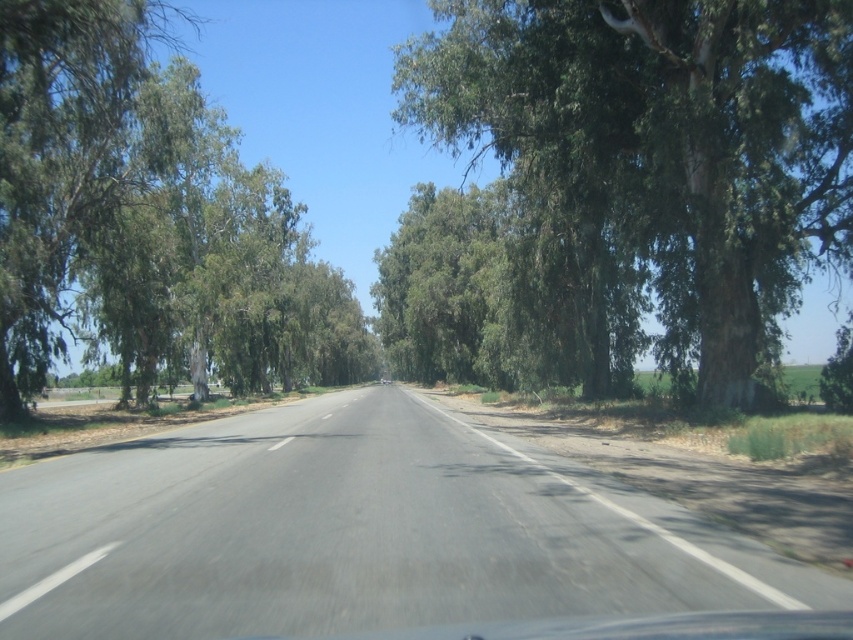
Question: Does green leafy tree at right have a larger size compared to green leafy tree at left?

Choices:
 (A) yes
 (B) no

Answer: (B)

Question: Among these points, which one is farthest from the camera?

Choices:
 (A) (590, 515)
 (B) (271, 332)

Answer: (B)

Question: Is asphalt road at center behind green leafy tree at left?

Choices:
 (A) no
 (B) yes

Answer: (A)

Question: Among these objects, which one is nearest to the camera?

Choices:
 (A) green leafy tree at right
 (B) asphalt road at center
 (C) green leafy tree at left

Answer: (B)

Question: Which object is positioned closest to the green leafy tree at left?

Choices:
 (A) green leafy tree at right
 (B) asphalt road at center

Answer: (A)

Question: Is the position of green leafy tree at right less distant than that of green leafy tree at left?

Choices:
 (A) no
 (B) yes

Answer: (A)